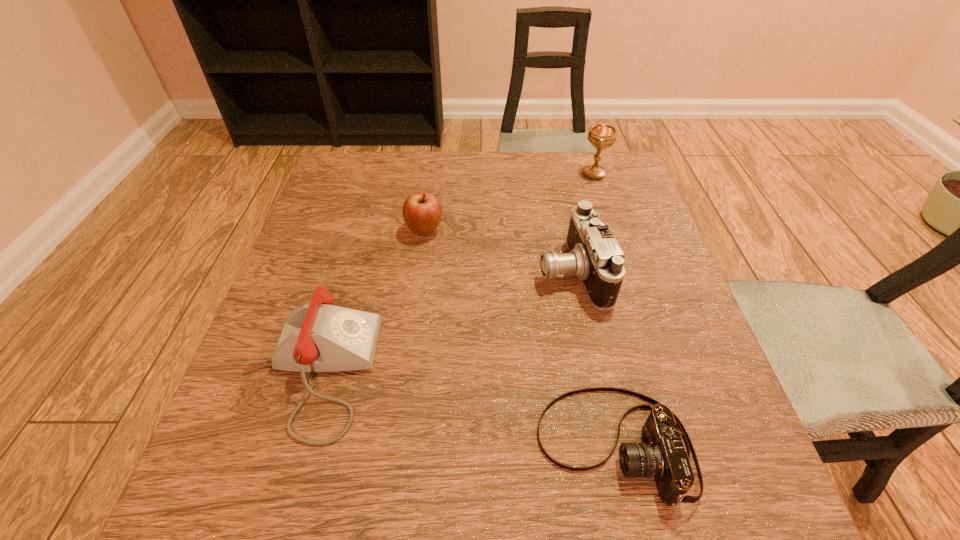
The width and height of the screenshot is (960, 540). In order to click on empty location between the chalice and the fourth object from right to left in this screenshot , I will do `click(510, 202)`.

At what (x,y) coordinates should I click in order to perform the action: click on vacant space in between the apple and the shorter camera. Please return your answer as a coordinate pair (x, y). The height and width of the screenshot is (540, 960). Looking at the image, I should click on coord(519,338).

You are a GUI agent. You are given a task and a screenshot of the screen. Output one action in this format:
    pyautogui.click(x=<x>, y=<y>)
    Task: Click on the vacant space that's between the nearer camera and the apple
    
    Given the screenshot: What is the action you would take?
    pyautogui.click(x=519, y=338)

Find the location of a particular element. vacant point located between the shortest object and the fourth object from right to left is located at coordinates (519, 338).

You are a GUI agent. You are given a task and a screenshot of the screen. Output one action in this format:
    pyautogui.click(x=<x>, y=<y>)
    Task: Click on the unoccupied position between the leftmost object and the shortest object
    The height and width of the screenshot is (540, 960).
    Given the screenshot: What is the action you would take?
    pyautogui.click(x=462, y=408)

Locate an element on the screen. vacant space in between the farthest object and the apple is located at coordinates (510, 202).

Select which object is the closest to the apple. Please provide its 2D coordinates. Your answer should be formatted as a tuple, i.e. [(x, y)], where the tuple contains the x and y coordinates of a point satisfying the conditions above.

[(320, 337)]

Where is `the second closest object relative to the apple`? The height and width of the screenshot is (540, 960). the second closest object relative to the apple is located at coordinates (595, 257).

Identify the location of free location that satisfies the following two spatial constraints: 1. on the front side of the farthest object; 2. on the front-facing side of the nearer camera. The width and height of the screenshot is (960, 540). (682, 446).

The height and width of the screenshot is (540, 960). I want to click on vacant region that satisfies the following two spatial constraints: 1. on the front side of the farthest object; 2. on the front-facing side of the shortest object, so click(682, 446).